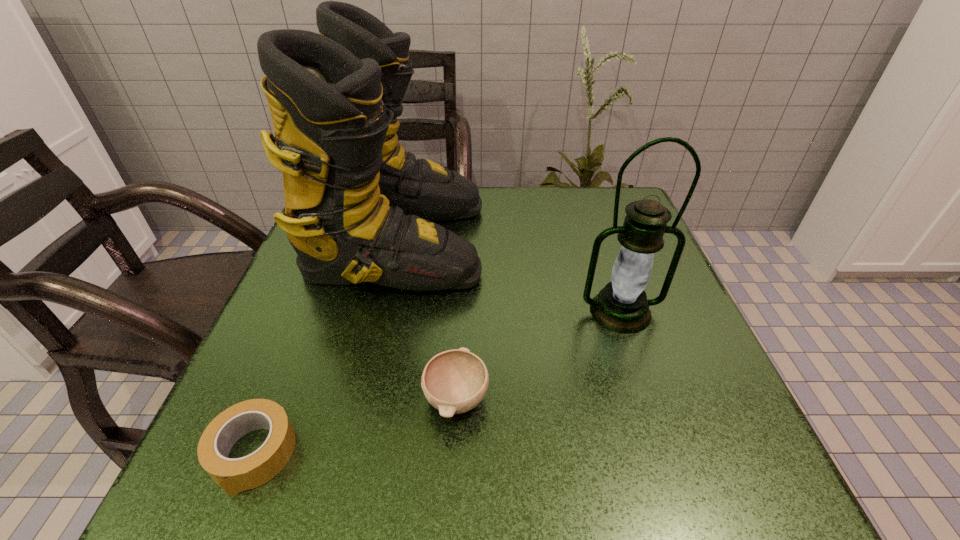
This screenshot has width=960, height=540. I want to click on ski boots positioned at the left edge, so 358,208.

The height and width of the screenshot is (540, 960). I want to click on duct tape at the left edge, so tap(236, 475).

Where is `object at the right edge`? Image resolution: width=960 pixels, height=540 pixels. object at the right edge is located at coordinates (622, 306).

Where is `object at the far left corner`? This screenshot has height=540, width=960. object at the far left corner is located at coordinates (358, 208).

Where is `object at the near left corner`? The height and width of the screenshot is (540, 960). object at the near left corner is located at coordinates (236, 475).

I want to click on vacant region at the far edge of the desktop, so click(x=518, y=195).

In the image, there is a desktop. At what (x,y) coordinates should I click in order to perform the action: click on vacant space at the near edge. Please return your answer as a coordinate pair (x, y). The height and width of the screenshot is (540, 960). Looking at the image, I should click on (460, 475).

Where is `vacant region at the left edge of the desktop`? This screenshot has width=960, height=540. vacant region at the left edge of the desktop is located at coordinates (287, 281).

The height and width of the screenshot is (540, 960). Identify the location of blank space at the right edge of the desktop. 681,355.

This screenshot has width=960, height=540. Identify the location of vacant point at the far right corner. (595, 228).